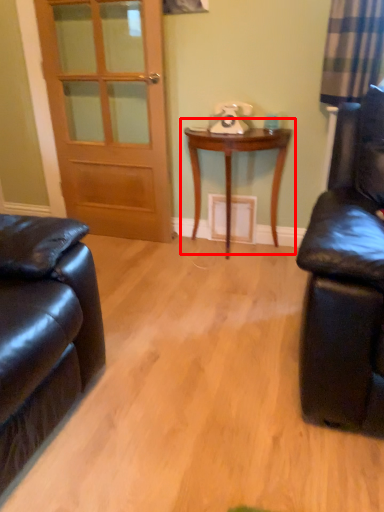
Question: From the image's perspective, considering the relative positions of table (annotated by the red box) and door in the image provided, where is table (annotated by the red box) located with respect to the staircase?

Choices:
 (A) below
 (B) above

Answer: (A)